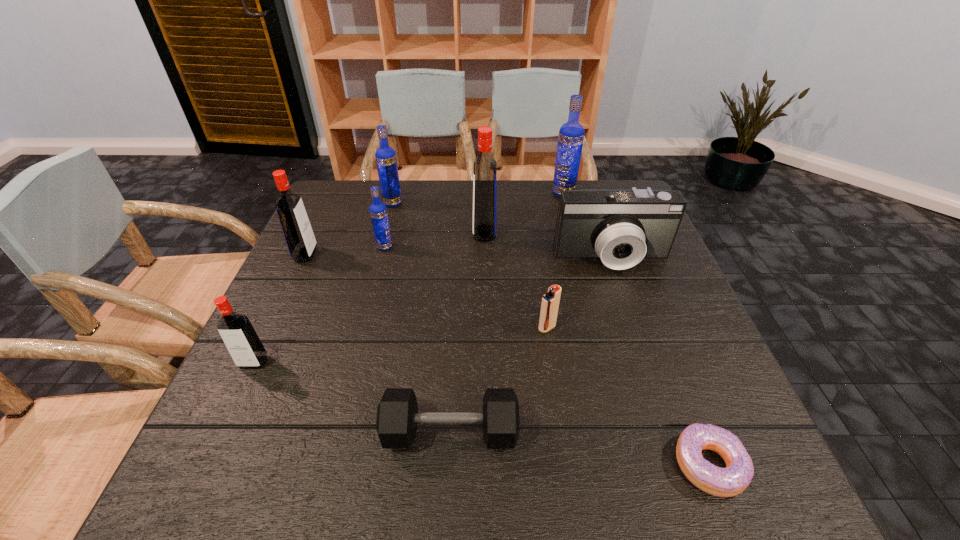
Locate an element on the screen. doughnut located in the right edge section of the desktop is located at coordinates (723, 482).

You are a GUI agent. You are given a task and a screenshot of the screen. Output one action in this format:
    pyautogui.click(x=<x>, y=<y>)
    Task: Click on the object located at the near right corner
    This screenshot has height=540, width=960.
    Given the screenshot: What is the action you would take?
    pyautogui.click(x=723, y=482)

In the image, there is a desktop. At what (x,y) coordinates should I click in order to perform the action: click on vacant space at the far edge. Please return your answer as a coordinate pair (x, y). This screenshot has width=960, height=540. Looking at the image, I should click on (402, 200).

Identify the location of vacant space at the left edge of the desktop. (329, 270).

I want to click on free location at the right edge, so click(x=692, y=336).

Locate an element on the screen. The width and height of the screenshot is (960, 540). free space at the far left corner is located at coordinates (365, 194).

The image size is (960, 540). In order to click on free location at the near left corner of the desktop in this screenshot , I will do `click(203, 462)`.

In the image, there is a desktop. Identify the location of free region at the far right corner. The width and height of the screenshot is (960, 540). (582, 185).

The image size is (960, 540). In order to click on free space at the near right corner of the desktop in this screenshot , I will do click(x=689, y=482).

At what (x,y) coordinates should I click in order to perform the action: click on empty location between the second smallest red vodka and the ninth tallest object. Please return your answer as a coordinate pair (x, y). Looking at the image, I should click on (378, 343).